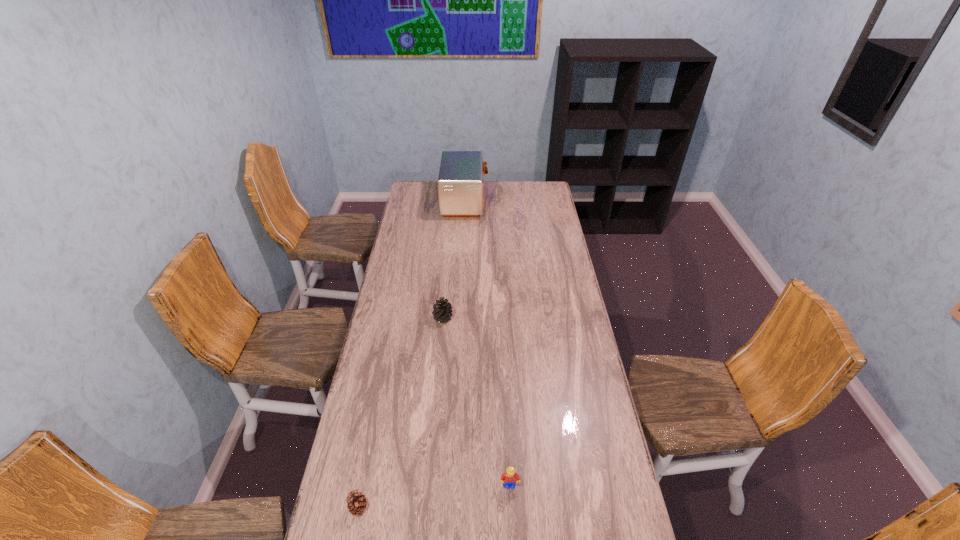
Locate an element on the screen. vacant space that satisfies the following two spatial constraints: 1. on the door side of the toaster oven; 2. on the front side of the right pinecone is located at coordinates (460, 318).